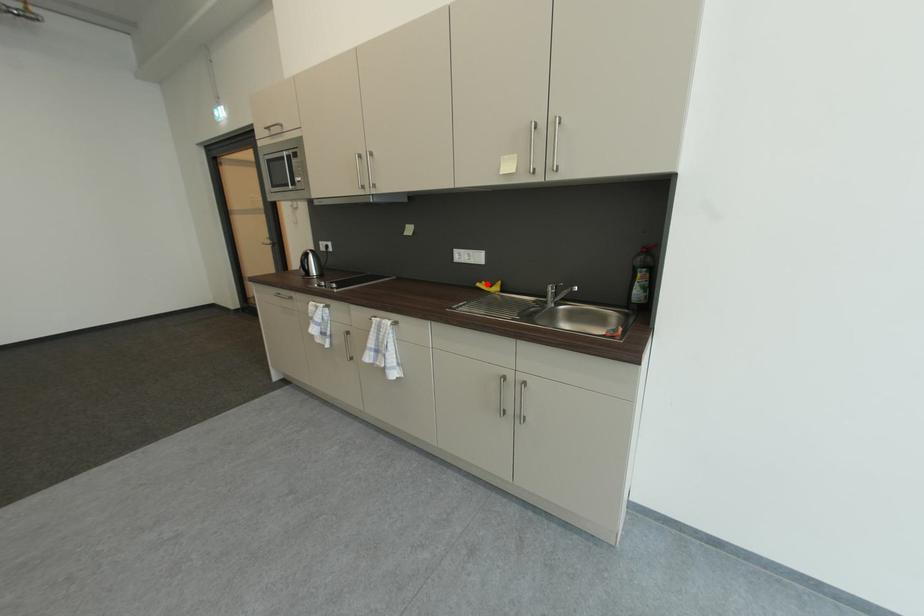
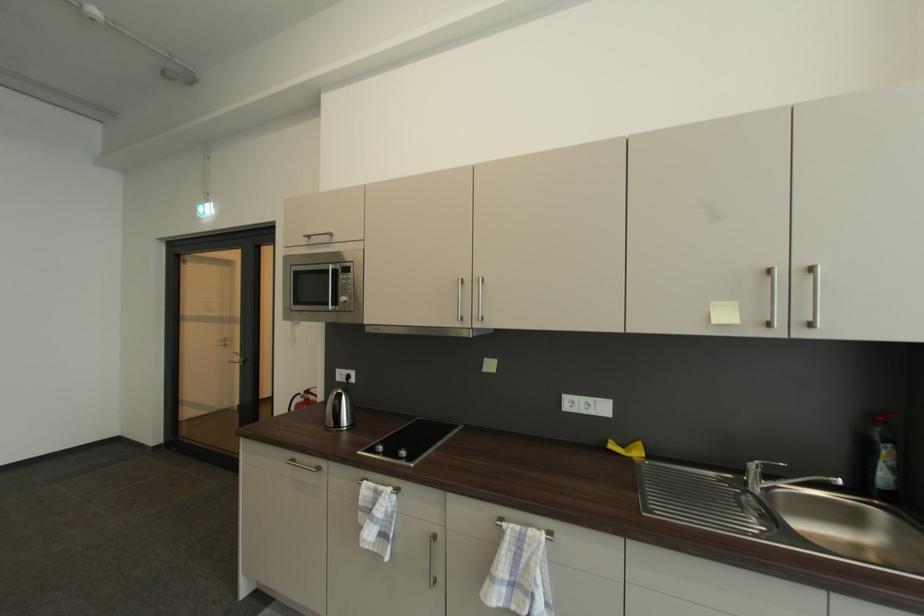
Question: I am providing you with two images of the same scene from different viewpoints. A red point is shown in image1. For the corresponding object point in image2, is it positioned nearer or farther from the camera?

Choices:
 (A) Nearer
 (B) Farther

Answer: (B)